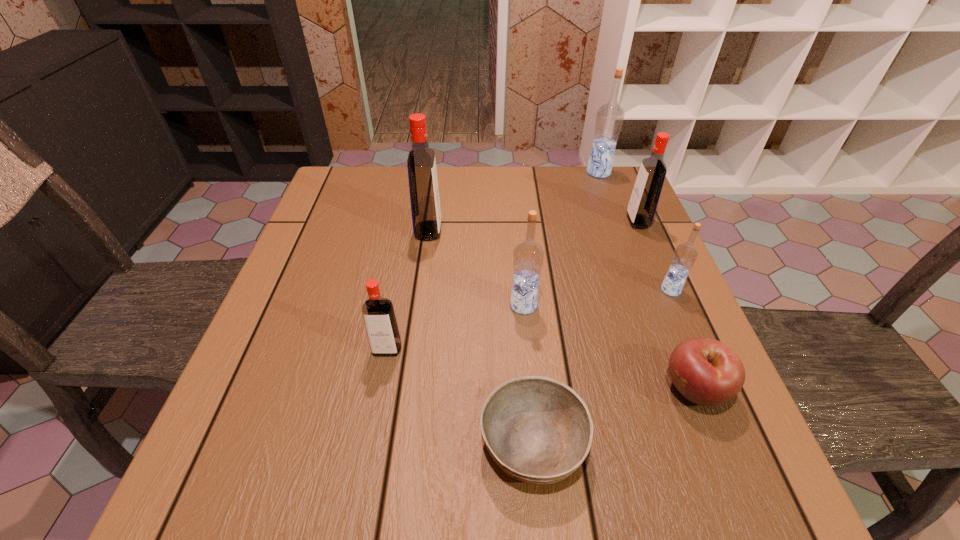
Identify the location of vacant space that satisfies the following two spatial constraints: 1. on the front and back of the biggest red vodka; 2. on the back side of the rightmost blue vodka. (420, 290).

Where is `free point that satisfies the following two spatial constraints: 1. on the front and back of the rightmost blue vodka; 2. on the left side of the biggest red vodka`? free point that satisfies the following two spatial constraints: 1. on the front and back of the rightmost blue vodka; 2. on the left side of the biggest red vodka is located at coordinates (420, 290).

In order to click on free location that satisfies the following two spatial constraints: 1. on the side of the apple with the unique marking; 2. on the front side of the shortest object in this screenshot , I will do `click(716, 443)`.